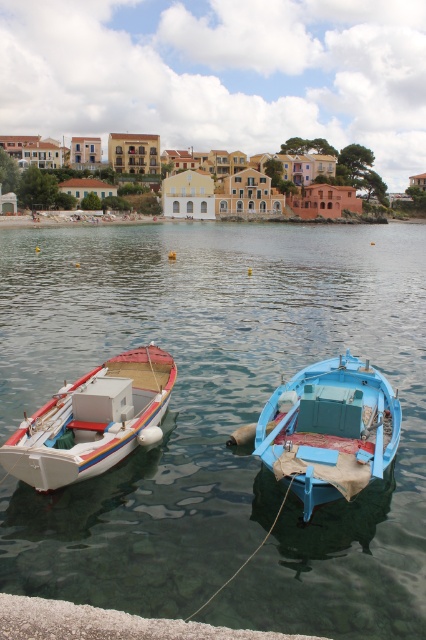
Can you confirm if clear water at center is thinner than white matte boat at left?

No, clear water at center is not thinner than white matte boat at left.

Is clear water at center smaller than white matte boat at left?

Incorrect, clear water at center is not smaller in size than white matte boat at left.

This screenshot has width=426, height=640. What do you see at coordinates (218, 420) in the screenshot?
I see `clear water at center` at bounding box center [218, 420].

The height and width of the screenshot is (640, 426). Identify the location of clear water at center. (218, 420).

Does blue painted wood boat at center appear under white matte boat at left?

Yes, blue painted wood boat at center is below white matte boat at left.

Which is in front, point (305, 385) or point (135, 422)?

Point (135, 422) is in front.

Where is `blue painted wood boat at center`? The height and width of the screenshot is (640, 426). blue painted wood boat at center is located at coordinates (330, 429).

Can you confirm if clear water at center is positioned above blue painted wood boat at center?

Yes, clear water at center is above blue painted wood boat at center.

How much distance is there between clear water at center and blue painted wood boat at center?

clear water at center is 37.00 feet from blue painted wood boat at center.

Where is `clear water at center`? The image size is (426, 640). clear water at center is located at coordinates (218, 420).

Where is `clear water at center`? Image resolution: width=426 pixels, height=640 pixels. clear water at center is located at coordinates tap(218, 420).